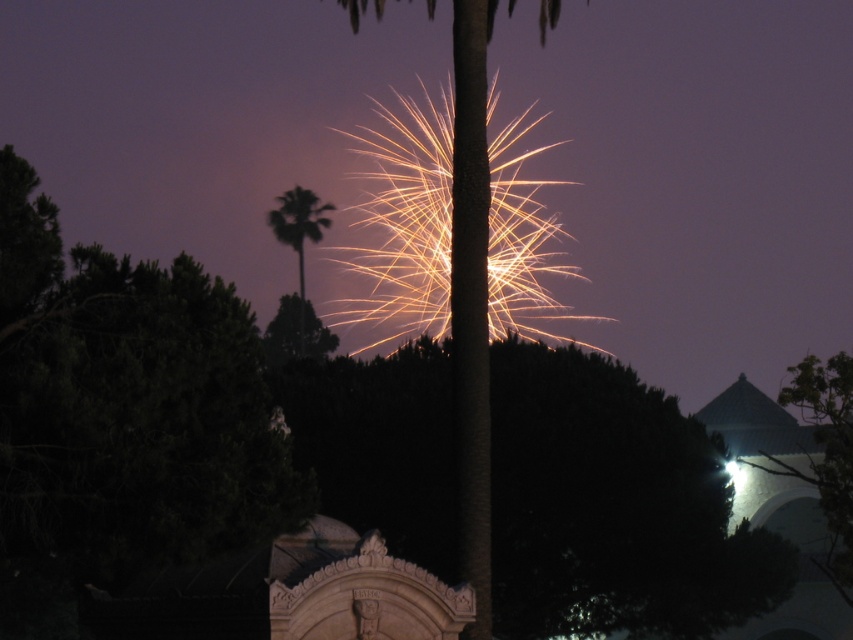
Is brown textured palm tree at center below green leafy palm tree at center?

Indeed, brown textured palm tree at center is positioned under green leafy palm tree at center.

Is point (456, 256) behind point (312, 216)?

That is False.

This screenshot has height=640, width=853. In order to click on brown textured palm tree at center in this screenshot , I will do [x=471, y=300].